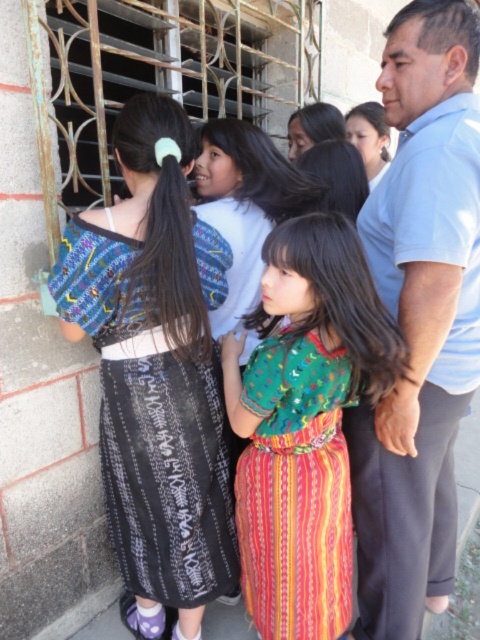
You are standing in the scene and want to take a photo of the green woven dress at center. Your camera is 4.47 feet away from the dress. Is the distance sufficient to capture the entire dress in the photo?

The green woven dress at center and camera are 4.47 feet apart from each other, so the distance should be sufficient to capture the entire dress in the photo as long as the camera has an appropriate lens or zoom setting.

You are a photographer trying to capture a clear shot of both the green woven dress at center and the matte green blouse at upper center. Which object should you focus on first to ensure both are in focus?

You should focus on the green woven dress at center first because it is closer to the viewer than the matte green blouse at upper center. By focusing on the closer object, the background object will also be in focus due to the depth of field.